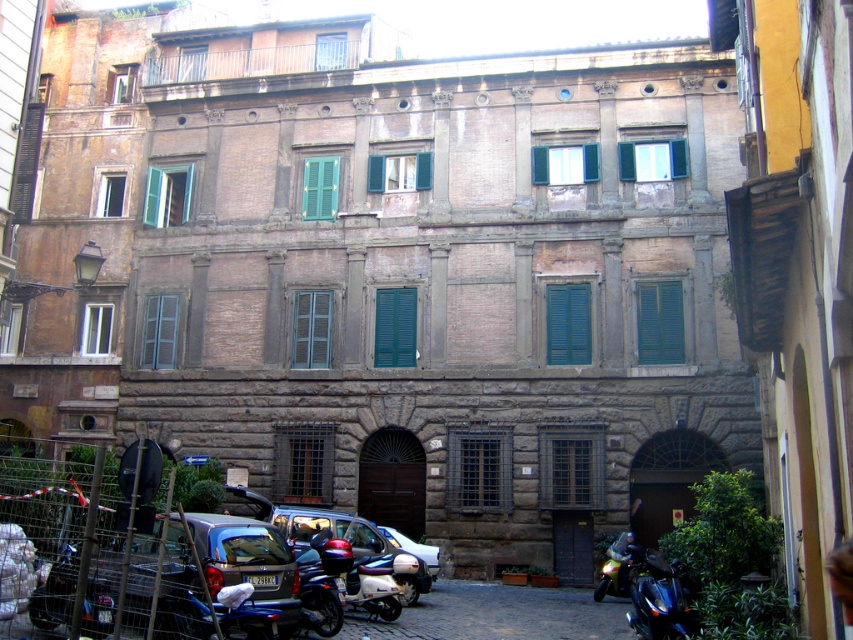
In the scene shown: You are a delivery person needing to park your motorcycle between the shiny blue motorcycle at lower right and the shiny black motorcycle at center. Which side should you park on to be between them?

You should park to the left of the shiny blue motorcycle at lower right because it is to the right of the shiny black motorcycle at center, so placing your motorcycle between them would require positioning it to the left of the shiny blue motorcycle at lower right.